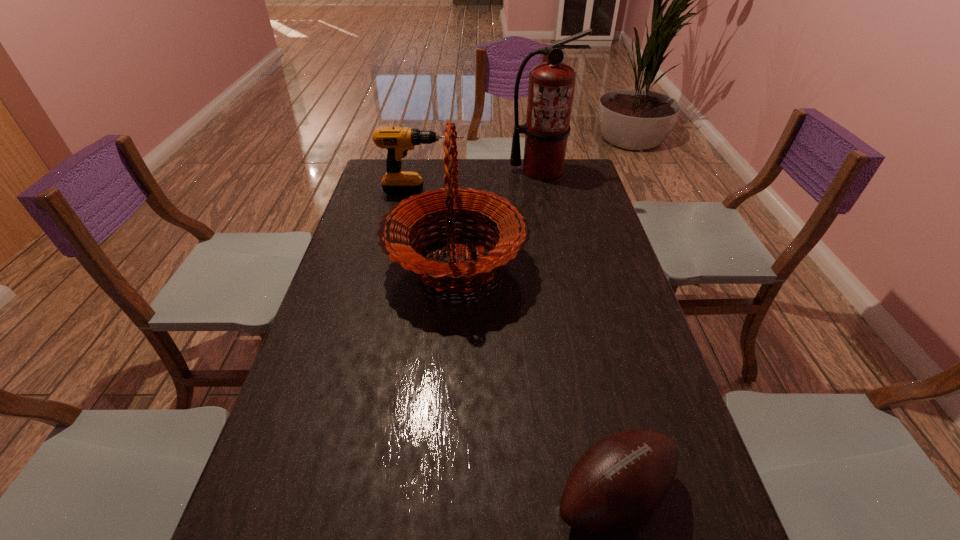
In order to click on vacant point located between the fire extinguisher and the third tallest object in this screenshot , I will do `click(482, 181)`.

Identify the location of object that is the third nearest to the third shortest object. (621, 479).

Locate which object is the second closest to the third shortest object. Please provide its 2D coordinates. Your answer should be formatted as a tuple, i.e. [(x, y)], where the tuple contains the x and y coordinates of a point satisfying the conditions above.

[(551, 84)]

In order to click on vacant space that satisfies the following two spatial constraints: 1. toward the nozzle of the farthest object; 2. at the tip of the third nearest object in this screenshot , I will do `click(545, 191)`.

Find the location of `free location that satisfies the following two spatial constraints: 1. toward the nozzle of the farthest object; 2. at the tip of the drill`. free location that satisfies the following two spatial constraints: 1. toward the nozzle of the farthest object; 2. at the tip of the drill is located at coordinates (545, 191).